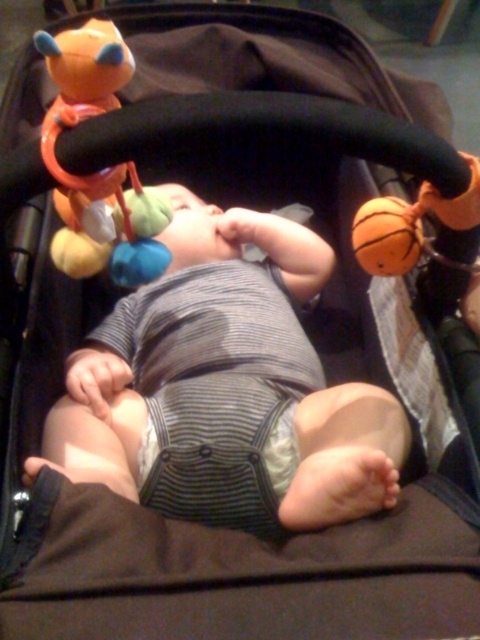
Question: Which point is closer to the camera?

Choices:
 (A) (255, 378)
 (B) (111, 65)

Answer: (B)

Question: Which point is closer to the camera?

Choices:
 (A) matte orange plush toy at upper left
 (B) striped fabric baby at center

Answer: (A)

Question: Can you confirm if striped fabric baby at center is smaller than matte orange plush toy at upper left?

Choices:
 (A) yes
 (B) no

Answer: (B)

Question: Where is striped fabric baby at center located in relation to matte orange plush toy at upper left in the image?

Choices:
 (A) below
 (B) above

Answer: (A)

Question: Does striped fabric baby at center appear over matte orange plush toy at upper left?

Choices:
 (A) no
 (B) yes

Answer: (A)